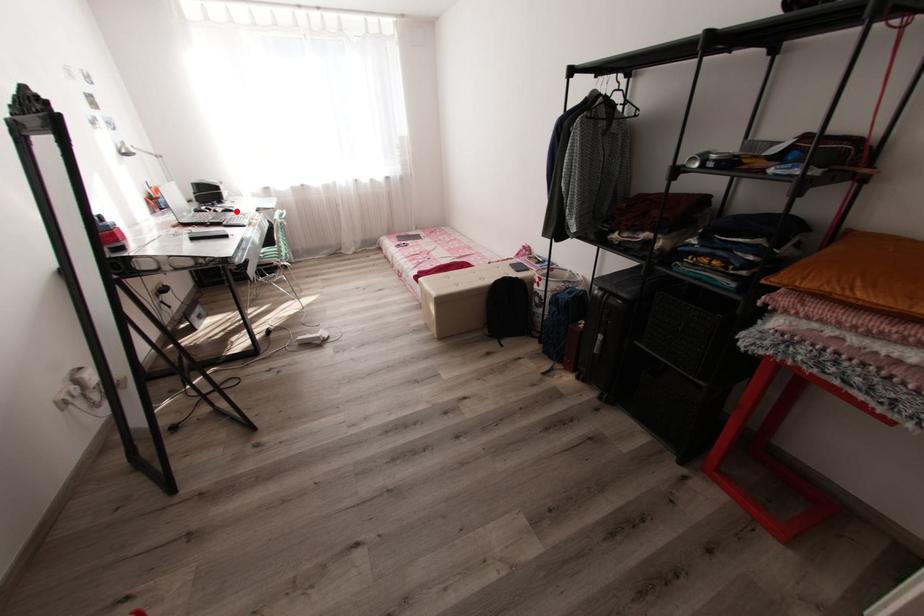
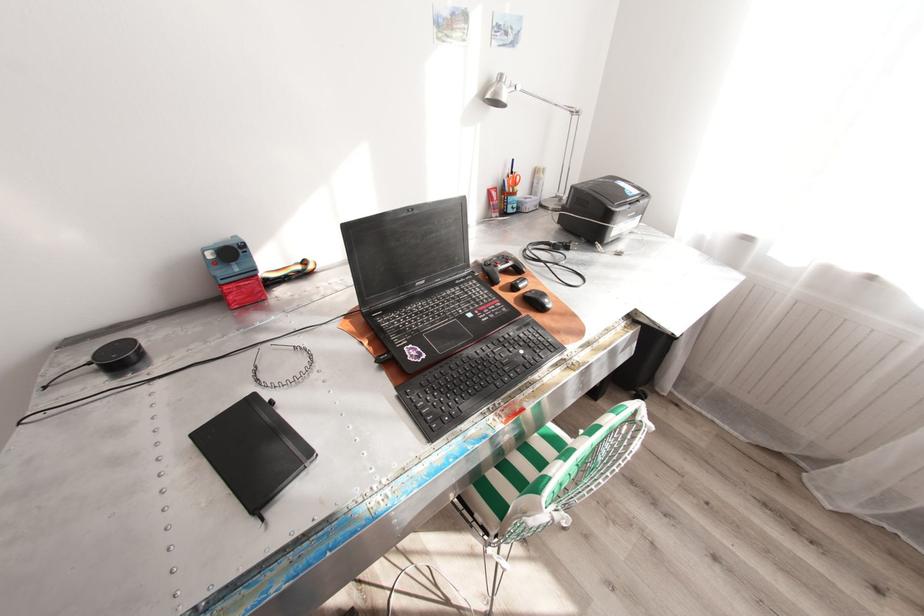
Where in the second image is the point corresponding to the highlighted location from the first image?

(545, 308)